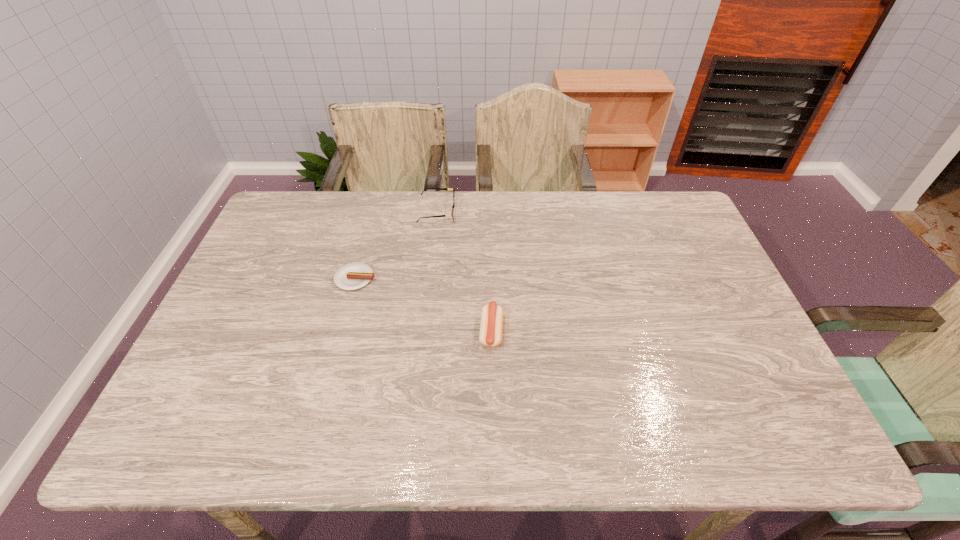
Find the location of a particular element. The image size is (960, 540). free point between the farther sausage and the nearest object is located at coordinates (423, 305).

Identify the location of unoccupied area between the spectacles and the nearer sausage. Image resolution: width=960 pixels, height=540 pixels. (464, 272).

Locate an element on the screen. free space between the farthest object and the second nearest object is located at coordinates (396, 245).

The width and height of the screenshot is (960, 540). In order to click on free area in between the leftmost object and the second object from right to left in this screenshot , I will do (396, 245).

Where is `vacant area that lies between the nearest object and the leftmost object`? Image resolution: width=960 pixels, height=540 pixels. vacant area that lies between the nearest object and the leftmost object is located at coordinates (423, 305).

The image size is (960, 540). Identify the location of object that ranks as the closest to the farthest object. (351, 276).

In order to click on the second closest object relative to the spectacles in this screenshot , I will do `click(491, 325)`.

Find the location of a particular element. The image size is (960, 540). free spot that satisfies the following two spatial constraints: 1. on the front-facing side of the nearest object; 2. on the left side of the farthest object is located at coordinates (423, 331).

The width and height of the screenshot is (960, 540). I want to click on vacant space that satisfies the following two spatial constraints: 1. on the front-facing side of the farthest object; 2. on the left side of the taller sausage, so click(x=423, y=331).

This screenshot has width=960, height=540. In order to click on free space that satisfies the following two spatial constraints: 1. on the front-facing side of the farthest object; 2. on the front side of the shorter sausage in this screenshot , I will do `click(429, 278)`.